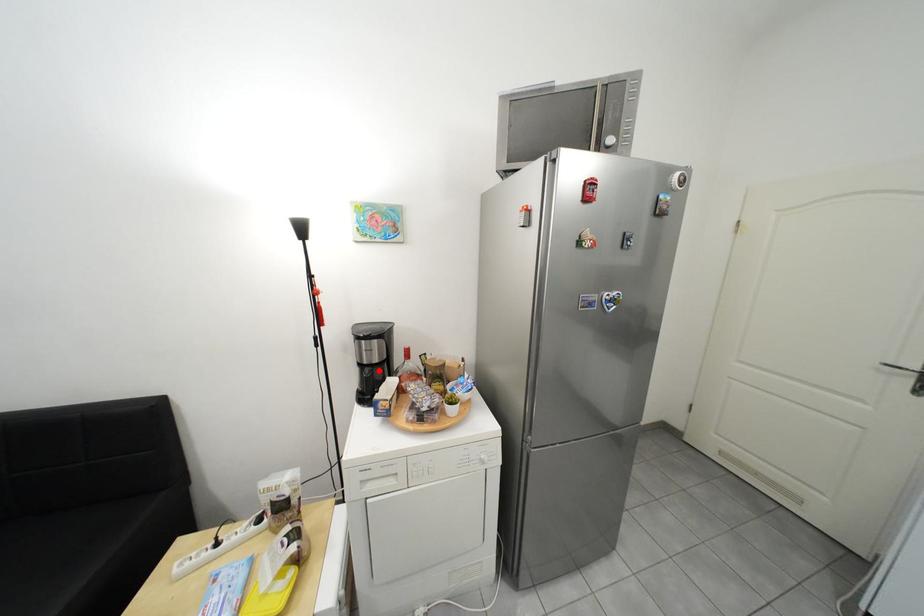
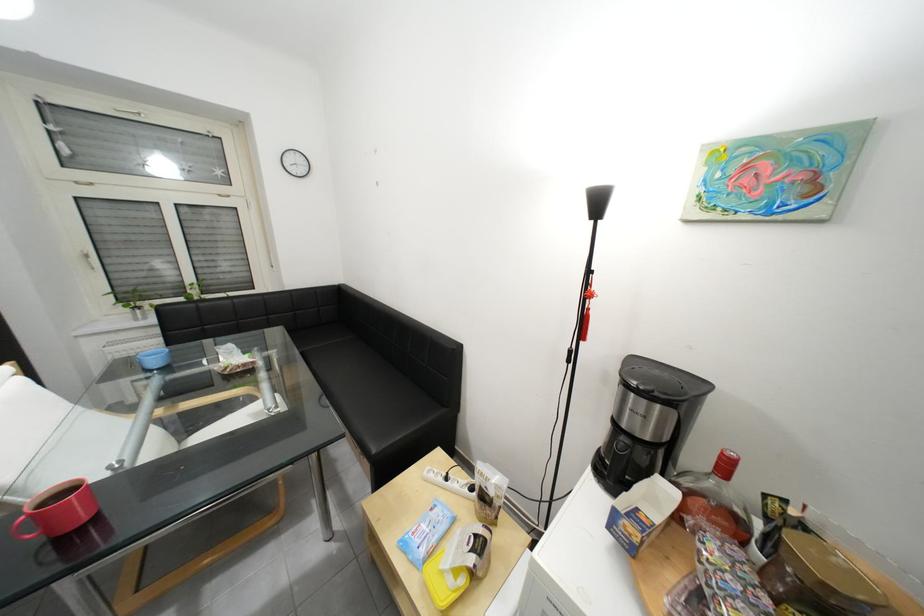
Where in the second image is the point corresponding to the highlighted location from the first image?

(636, 440)